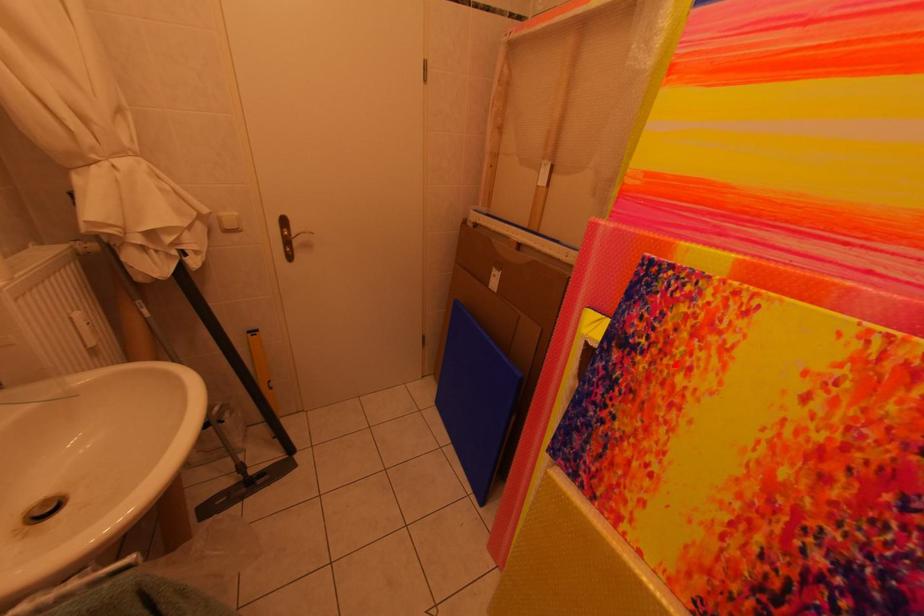
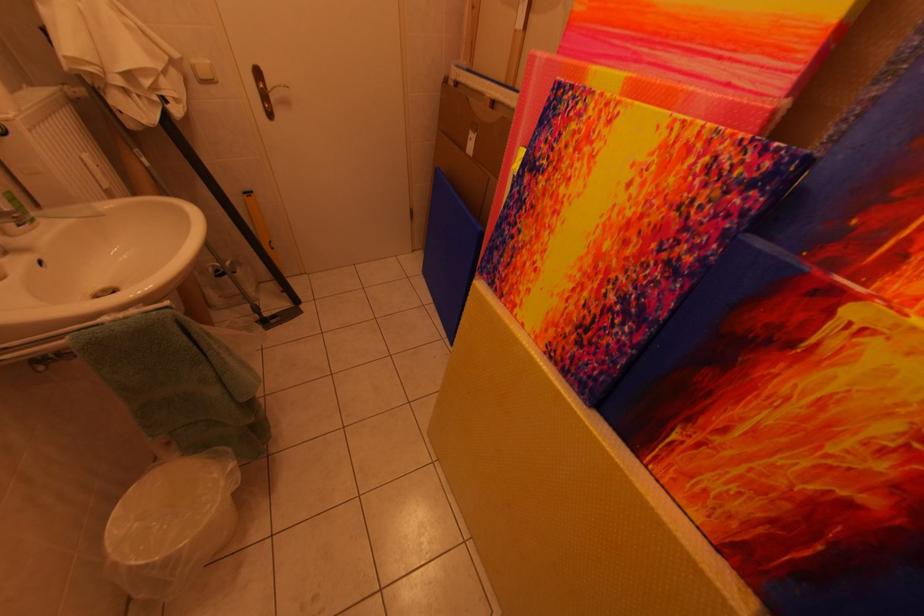
In the second image, find the point that corresponds to the highlighted location in the first image.

(565, 180)